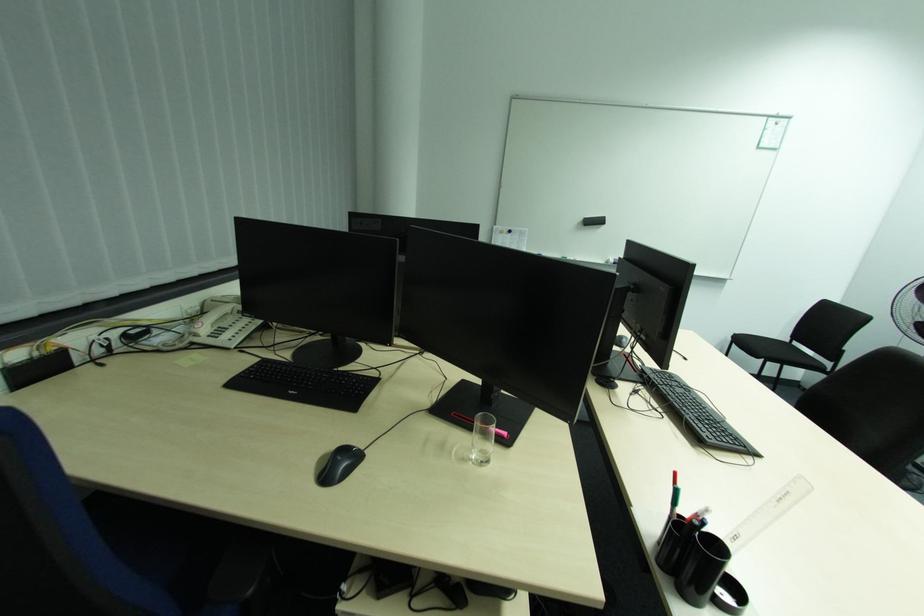
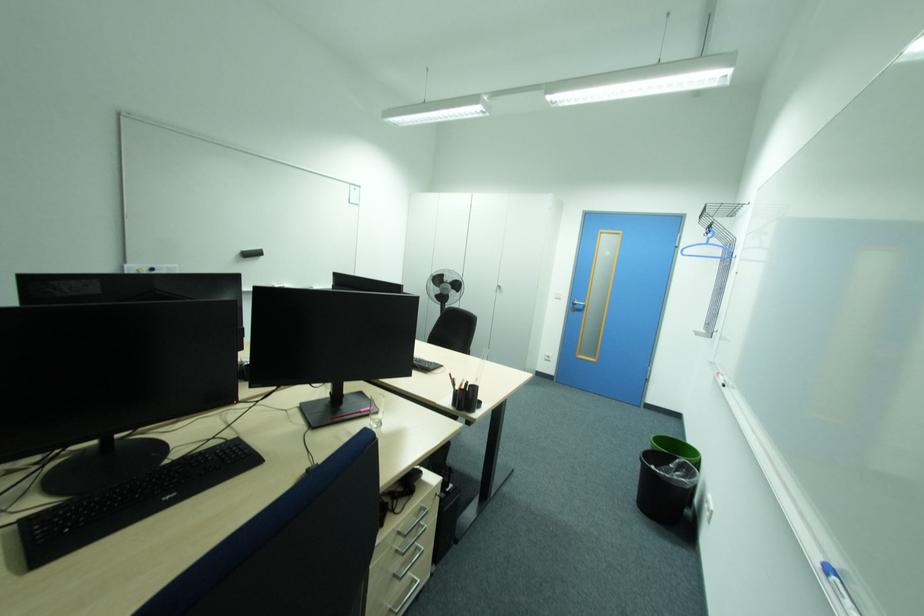
Question: How did the camera likely rotate?

Choices:
 (A) Left
 (B) Right
 (C) Up
 (D) Down

Answer: (B)